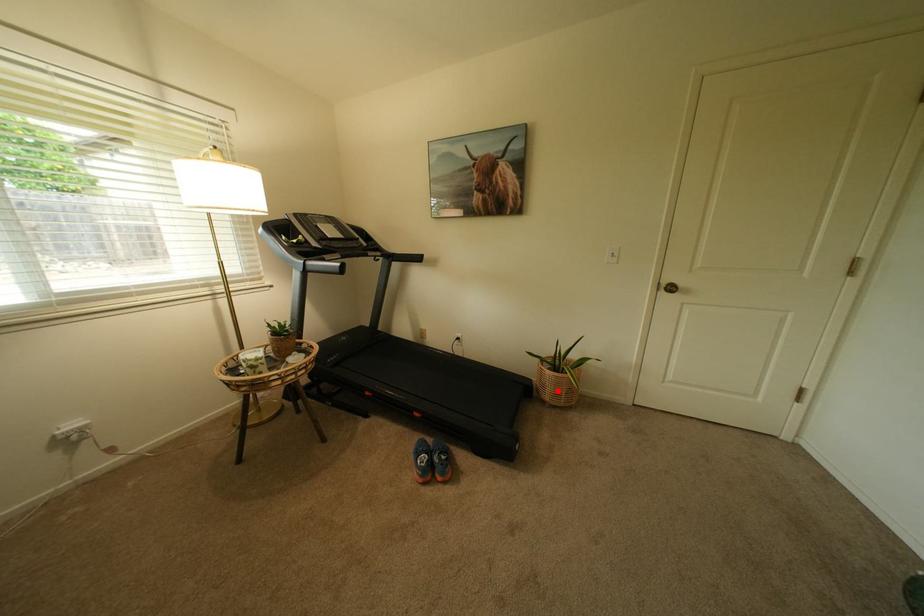
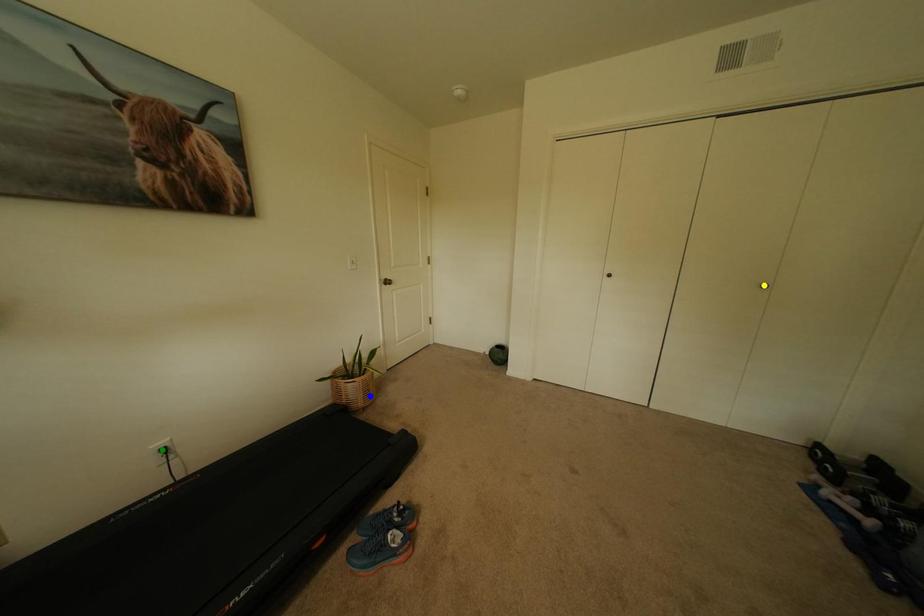
Question: I am providing you with two images of the same scene from different viewpoints. A red point is marked on the first image. You are given multiple points on the second image. Which spot in image 2 lines up with the point in image 1?

Choices:
 (A) blue point
 (B) yellow point
 (C) green point

Answer: (A)